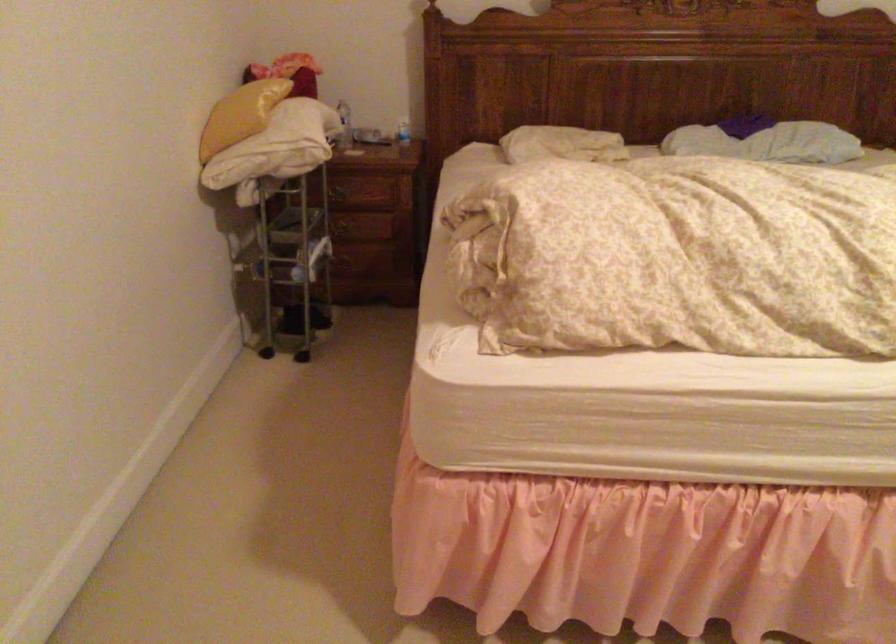
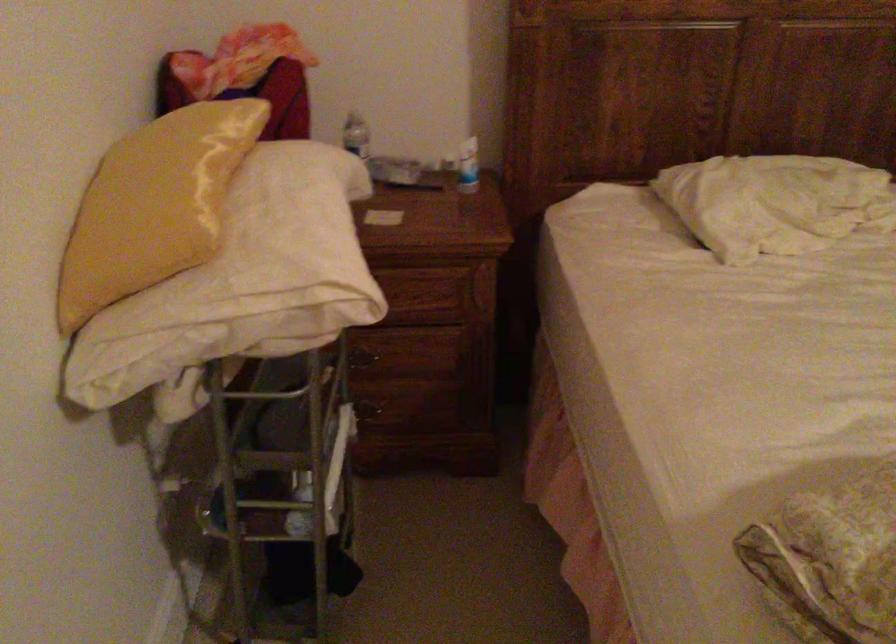
Where in the second image is the point corresponding to point (555, 138) from the first image?

(774, 202)